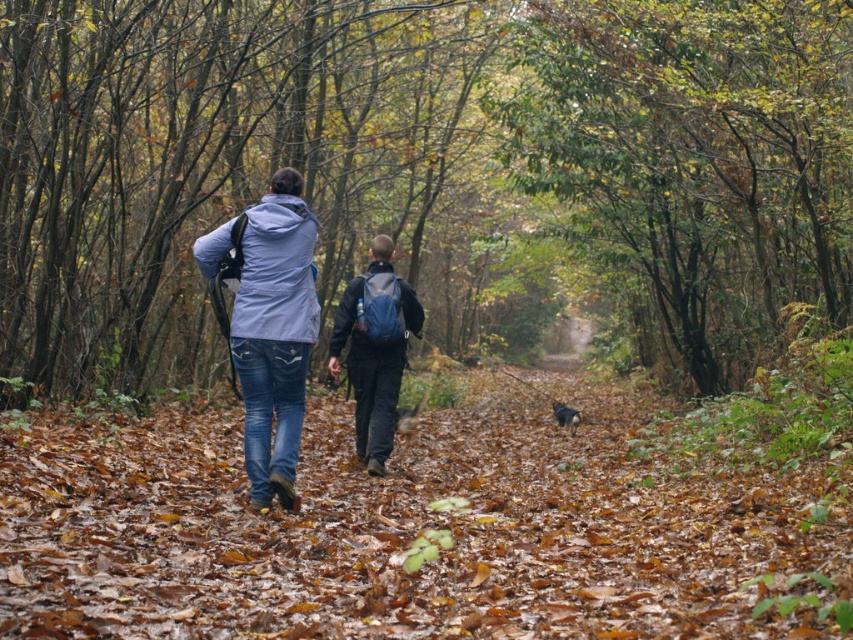
You are standing at the camera position in the image and want to walk towards the brown leafy forest path at center. Which direction should you move in order to reach it?

The brown leafy forest path at center is located at point 0.827 on the x axis and 0.492 on the y axis, so you should move forward and slightly to the right to reach it.

You are a hiker carrying a backpack that is 2 meters long. You want to place your backpack along the brown leafy forest path at center so that it reaches the matte blue jacket at center. Is this possible?

The distance between the brown leafy forest path at center and the matte blue jacket at center is 2.75 meters. Since the backpack is only 2 meters long, it cannot span the entire distance between them.

You are standing at the viewpoint and want to reach the point marked as point (415, 481). If you walk straight ahead, how far will you have to walk to reach that point?

The distance between the viewpoint and point (415, 481) is 10.64 meters, so you will have to walk 10.64 meters straight ahead to reach it.